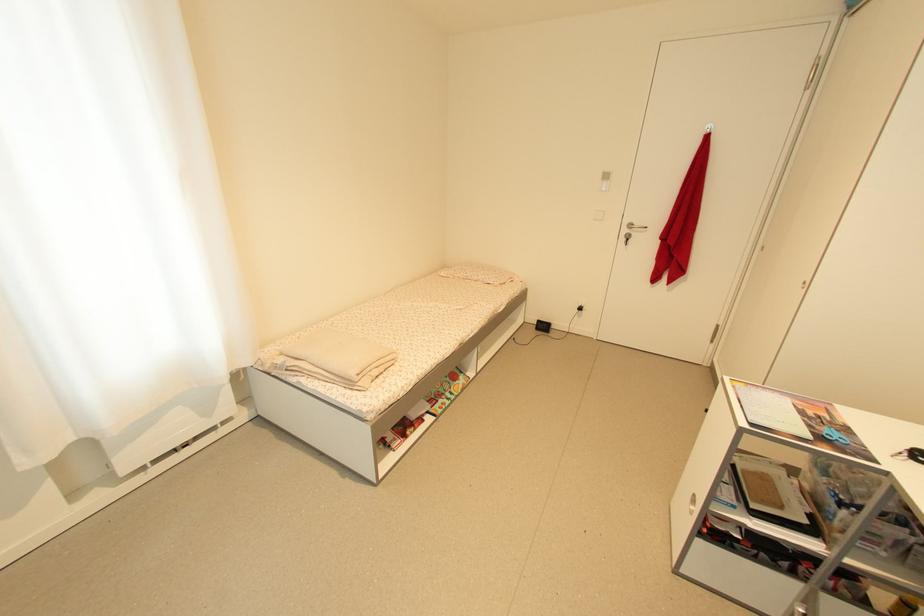
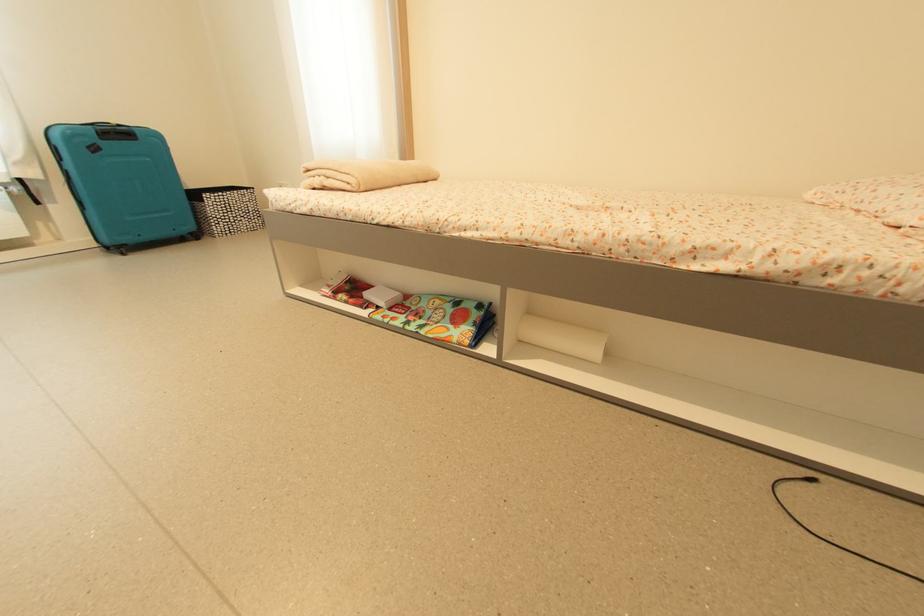
The point at (x=419, y=418) is marked in the first image. Where is the corresponding point in the second image?

(371, 296)